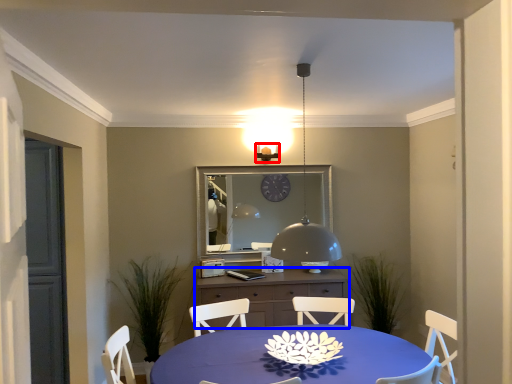
Question: Which object is closer to the camera taking this photo, light fixture (highlighted by a red box) or cabinetry (highlighted by a blue box)?

Choices:
 (A) light fixture
 (B) cabinetry

Answer: (B)